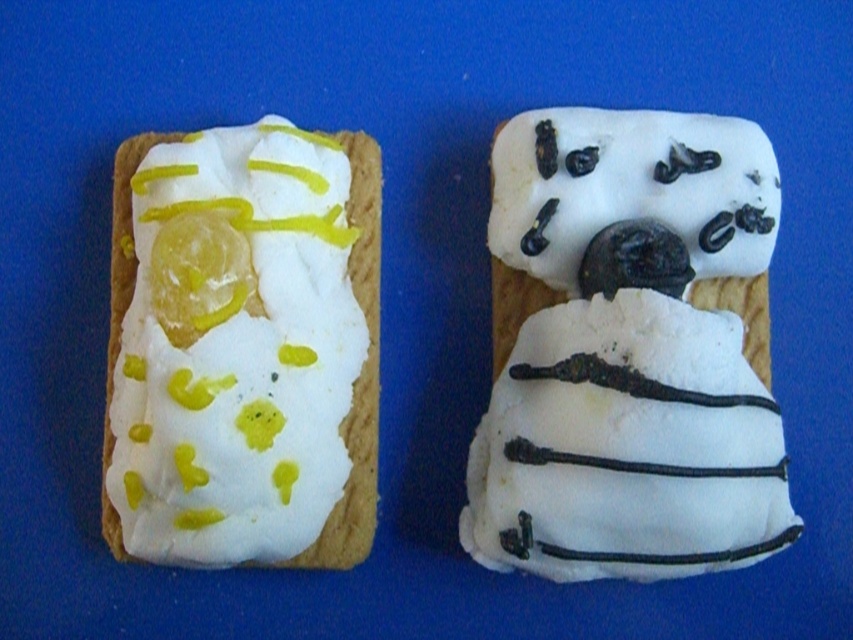
Does point (682, 547) lie in front of point (370, 474)?

Yes, point (682, 547) is in front of point (370, 474).

Who is taller, white fondant figure at center or white cream cheese at left?

Standing taller between the two is white fondant figure at center.

Is point (616, 216) farther from viewer compared to point (376, 248)?

No.

Locate an element on the screen. This screenshot has height=640, width=853. white fondant figure at center is located at coordinates (630, 349).

Between point (747, 385) and point (624, 112), which one is positioned behind?

Point (624, 112)

The width and height of the screenshot is (853, 640). In order to click on white fondant figure at center in this screenshot , I will do `click(630, 349)`.

Between point (543, 269) and point (364, 243), which one is positioned in front?

Point (543, 269)

Image resolution: width=853 pixels, height=640 pixels. I want to click on white matte frosting at center, so click(631, 188).

Identify the location of white matte frosting at center. The height and width of the screenshot is (640, 853). (631, 188).